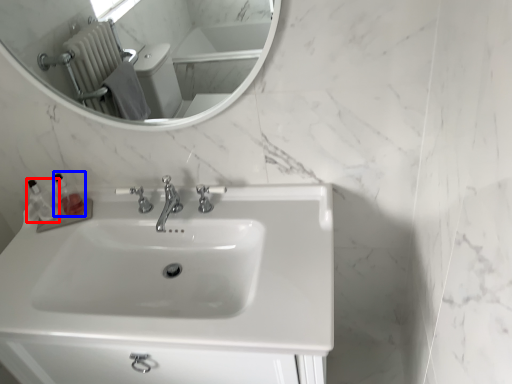
Question: Which object is further to the camera taking this photo, toiletry (highlighted by a red box) or toiletry (highlighted by a blue box)?

Choices:
 (A) toiletry
 (B) toiletry

Answer: (B)